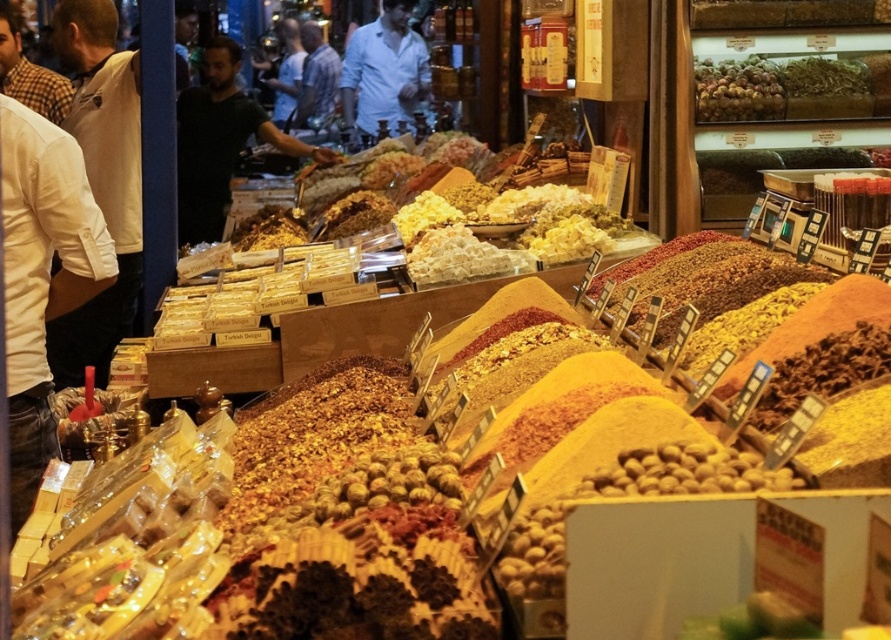
The height and width of the screenshot is (640, 891). What do you see at coordinates (383, 70) in the screenshot? I see `white cotton shirt at center` at bounding box center [383, 70].

Does white cotton shirt at center have a lesser width compared to dark blue shirt at center?

No, white cotton shirt at center is not thinner than dark blue shirt at center.

Is point (348, 100) positioned in front of point (282, 118)?

That is False.

Locate an element on the screen. The height and width of the screenshot is (640, 891). white cotton shirt at center is located at coordinates (383, 70).

Which of these two, green leafy vegetables at upper right or white cotton shirt at center, stands shorter?

green leafy vegetables at upper right

Can you confirm if green leafy vegetables at upper right is shorter than white cotton shirt at center?

Indeed, green leafy vegetables at upper right has a lesser height compared to white cotton shirt at center.

Where is `green leafy vegetables at upper right`? green leafy vegetables at upper right is located at coordinates (791, 88).

Find the location of a particular element. green leafy vegetables at upper right is located at coordinates (791, 88).

The width and height of the screenshot is (891, 640). Find the location of `black matte shirt at center`. black matte shirt at center is located at coordinates (219, 141).

Does black matte shirt at center have a lesser width compared to green leafy vegetables at upper right?

No, black matte shirt at center is not thinner than green leafy vegetables at upper right.

At what (x,y) coordinates should I click in order to perform the action: click on black matte shirt at center. Please return your answer as a coordinate pair (x, y). This screenshot has height=640, width=891. Looking at the image, I should click on (219, 141).